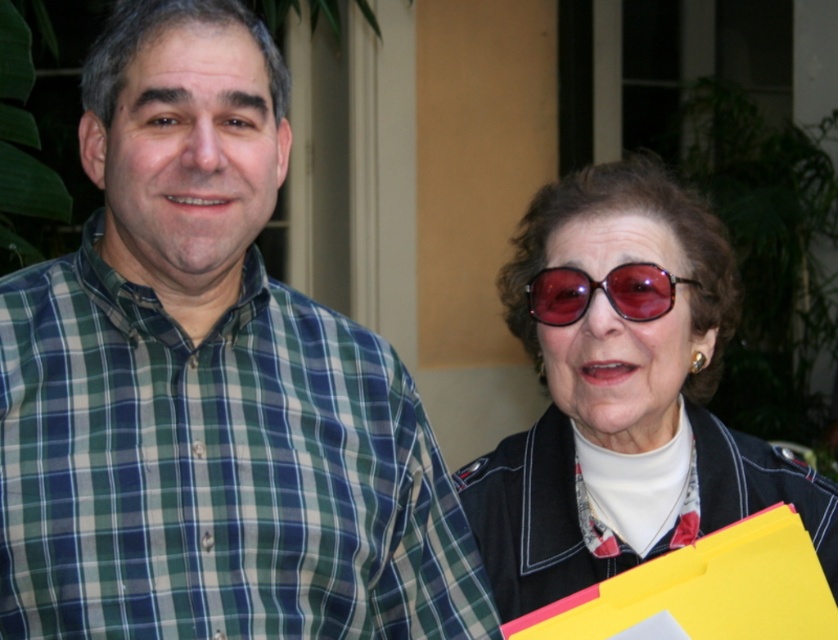
The height and width of the screenshot is (640, 838). In order to click on matte black sunglasses at upper right in this screenshot , I will do `click(622, 394)`.

Can you confirm if matte black sunglasses at upper right is bigger than red tortoiseshell sunglasses at upper center?

Yes.

Is point (541, 435) positioned after point (616, 305)?

Yes, point (541, 435) is farther from viewer.

Identify the location of matte black sunglasses at upper right. (622, 394).

Is point (273, 433) behind point (593, 285)?

No, (273, 433) is in front of (593, 285).

How far apart are green plaid shirt at center and red tortoiseshell sunglasses at upper center?

green plaid shirt at center and red tortoiseshell sunglasses at upper center are 20.68 inches apart from each other.

Identify the location of green plaid shirt at center. (208, 387).

From the picture: Does green plaid shirt at center appear over matte black sunglasses at upper right?

Actually, green plaid shirt at center is below matte black sunglasses at upper right.

Is green plaid shirt at center behind matte black sunglasses at upper right?

No, green plaid shirt at center is in front of matte black sunglasses at upper right.

Identify the location of green plaid shirt at center. The height and width of the screenshot is (640, 838). (208, 387).